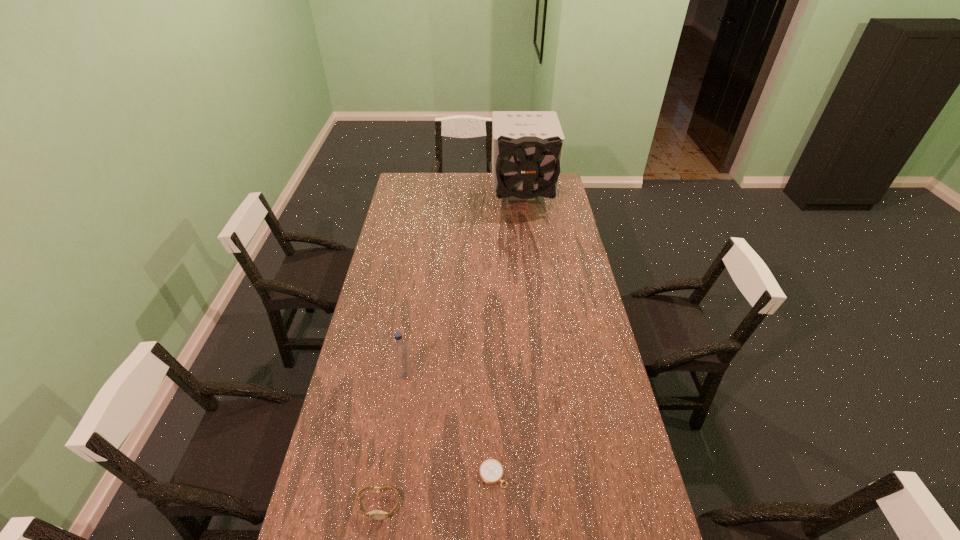
Identify which object is the third closest to the second farthest object. Please provide its 2D coordinates. Your answer should be formatted as a tuple, i.e. [(x, y)], where the tuple contains the x and y coordinates of a point satisfying the conditions above.

[(527, 146)]